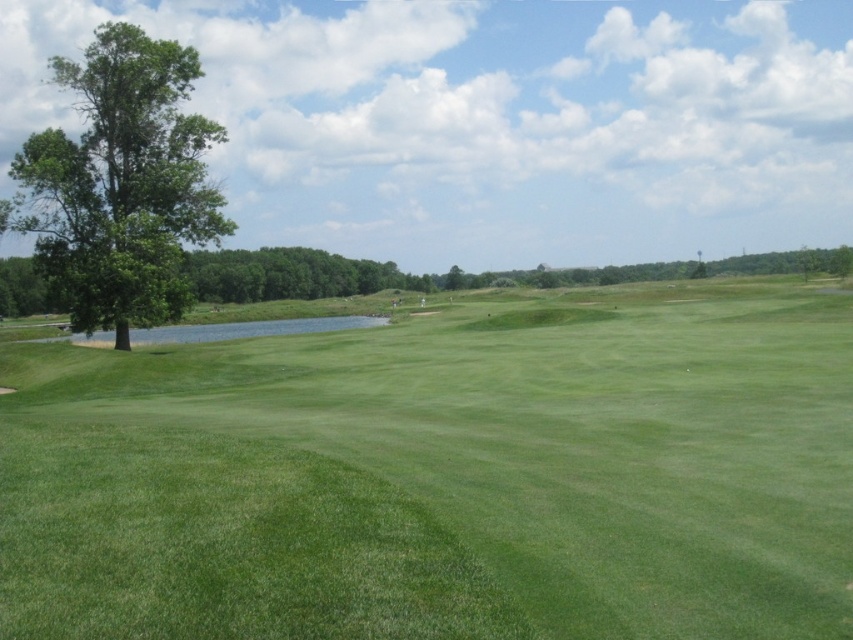
Question: Among these objects, which one is farthest from the camera?

Choices:
 (A) green leafy tree at left
 (B) green grassy field at center

Answer: (A)

Question: Among these points, which one is farthest from the camera?

Choices:
 (A) (93, 326)
 (B) (135, 513)

Answer: (A)

Question: Is green grassy field at center thinner than green leafy tree at left?

Choices:
 (A) no
 (B) yes

Answer: (B)

Question: Which of the following is the farthest from the observer?

Choices:
 (A) (216, 131)
 (B) (549, 355)

Answer: (A)

Question: Does green grassy field at center have a larger size compared to green leafy tree at left?

Choices:
 (A) yes
 (B) no

Answer: (B)

Question: Is green grassy field at center above green leafy tree at left?

Choices:
 (A) yes
 (B) no

Answer: (B)